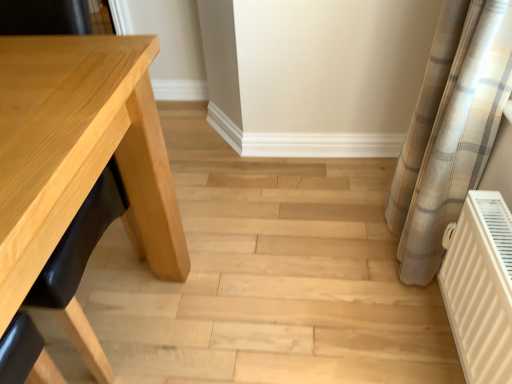
I want to click on free spot in front of plaid fabric curtain at right, so click(384, 325).